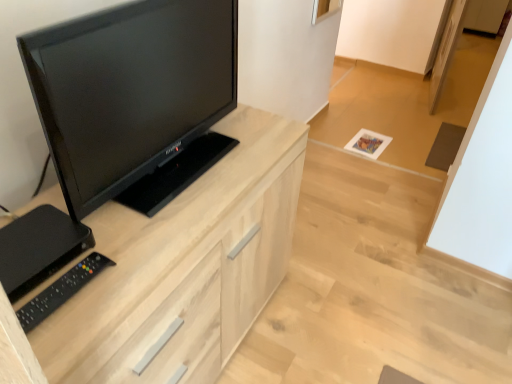
Question: Is light wood cabinet at center completely or partially outside of black plastic remote at lower left?

Choices:
 (A) yes
 (B) no

Answer: (A)

Question: Considering the relative positions of light wood cabinet at center and black plastic remote at lower left in the image provided, is light wood cabinet at center to the right of black plastic remote at lower left from the viewer's perspective?

Choices:
 (A) yes
 (B) no

Answer: (A)

Question: Considering the relative sizes of light wood cabinet at center and black plastic remote at lower left in the image provided, is light wood cabinet at center smaller than black plastic remote at lower left?

Choices:
 (A) yes
 (B) no

Answer: (B)

Question: Could you tell me if light wood cabinet at center is turned towards black plastic remote at lower left?

Choices:
 (A) yes
 (B) no

Answer: (B)

Question: Is light wood cabinet at center not near black plastic remote at lower left?

Choices:
 (A) no
 (B) yes

Answer: (A)

Question: From the image's perspective, is light wood cabinet at center below black plastic remote at lower left?

Choices:
 (A) yes
 (B) no

Answer: (A)

Question: Is light wood cabinet at center completely or partially outside of black glossy tv at left?

Choices:
 (A) no
 (B) yes

Answer: (B)

Question: Does light wood cabinet at center lie in front of black glossy tv at left?

Choices:
 (A) yes
 (B) no

Answer: (B)

Question: Is black glossy tv at left at the back of light wood cabinet at center?

Choices:
 (A) no
 (B) yes

Answer: (A)

Question: From a real-world perspective, is light wood cabinet at center physically below black glossy tv at left?

Choices:
 (A) no
 (B) yes

Answer: (B)

Question: Is the depth of light wood cabinet at center greater than that of black glossy tv at left?

Choices:
 (A) no
 (B) yes

Answer: (B)

Question: Is light wood cabinet at center positioned far away from black glossy tv at left?

Choices:
 (A) no
 (B) yes

Answer: (A)

Question: Is black glossy tv at left oriented towards light wood cabinet at center?

Choices:
 (A) yes
 (B) no

Answer: (B)